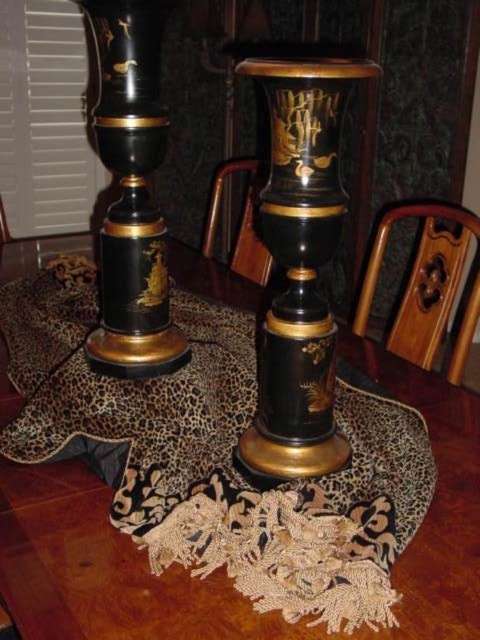
Question: Among these objects, which one is farthest from the camera?

Choices:
 (A) black lacquer pedestal at center
 (B) glossy lacquer candle holder at left
 (C) black lacquer vase at center

Answer: (B)

Question: Can you confirm if black lacquer vase at center is positioned to the right of glossy lacquer candle holder at left?

Choices:
 (A) yes
 (B) no

Answer: (A)

Question: Which object is positioned farthest from the black lacquer vase at center?

Choices:
 (A) black lacquer pedestal at center
 (B) glossy lacquer candle holder at left

Answer: (A)

Question: Which object appears closest to the camera in this image?

Choices:
 (A) glossy lacquer candle holder at left
 (B) black lacquer vase at center
 (C) black lacquer pedestal at center

Answer: (B)

Question: Does black lacquer pedestal at center appear over glossy lacquer candle holder at left?

Choices:
 (A) yes
 (B) no

Answer: (B)

Question: Observing the image, what is the correct spatial positioning of black lacquer vase at center in reference to glossy lacquer candle holder at left?

Choices:
 (A) above
 (B) below

Answer: (B)